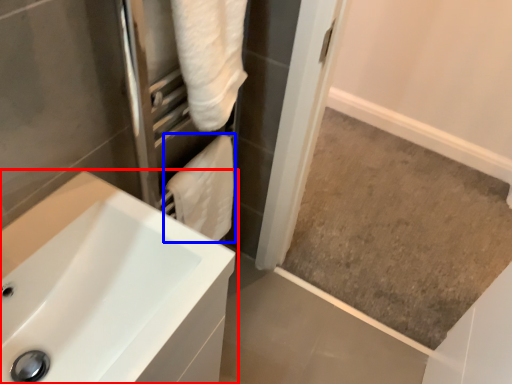
Question: Among these objects, which one is farthest to the camera, sink (highlighted by a red box) or bath towel (highlighted by a blue box)?

Choices:
 (A) sink
 (B) bath towel

Answer: (B)